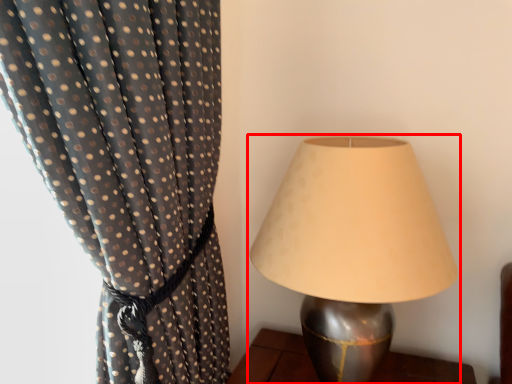
Question: In this image, where is lamp (annotated by the red box) located relative to curtain?

Choices:
 (A) left
 (B) right

Answer: (B)